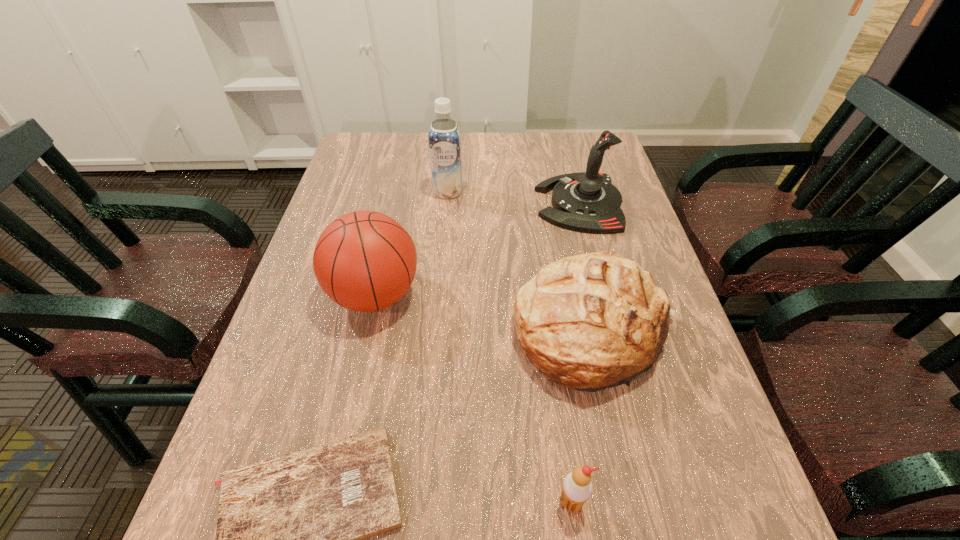
This screenshot has width=960, height=540. In order to click on free space between the joystick and the basketball in this screenshot , I will do `click(477, 249)`.

Identify the location of free area in between the icecream and the tallest object. This screenshot has width=960, height=540. (510, 347).

Identify the location of vacant point located between the tallest object and the joystick. (514, 198).

Find the location of a particular element. This screenshot has height=540, width=960. vacant area between the basketball and the icecream is located at coordinates (473, 399).

I want to click on object that is the closest one to the joystick, so (x=592, y=321).

This screenshot has height=540, width=960. Identify the location of object that can be found as the closest to the tallest object. (588, 202).